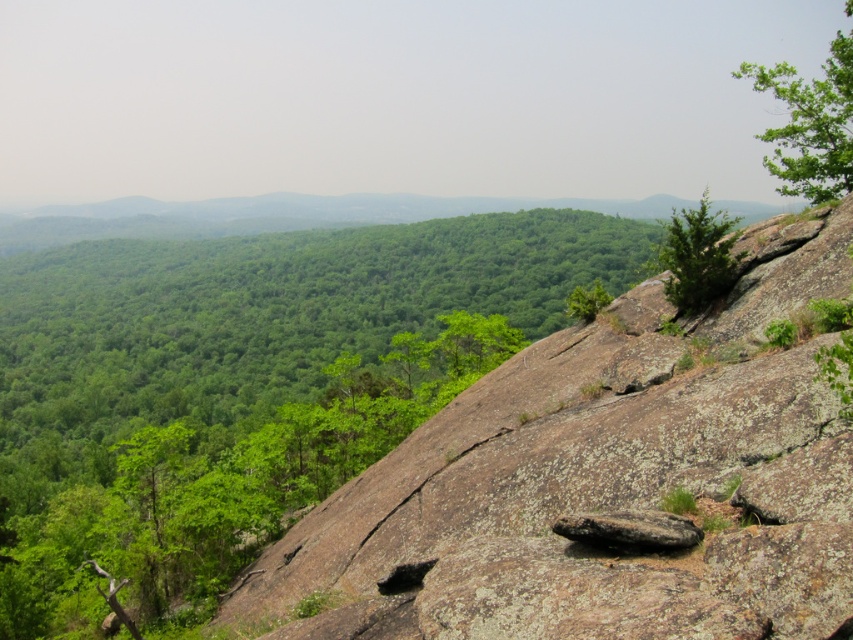
You are a hiker standing on the rocky outcrop and looking at the green leafy tree at upper right and the green rough textured tree at upper right. Which tree is positioned higher in the image?

The green leafy tree at upper right is positioned higher than the green rough textured tree at upper right in the image.

Looking at this image, you are a hiker trying to identify two trees in the upper right corner of the image. Which tree has a greater width between the green leafy tree at upper right and the green rough textured tree at upper right?

The green leafy tree at upper right has a greater width than the green rough textured tree at upper right.